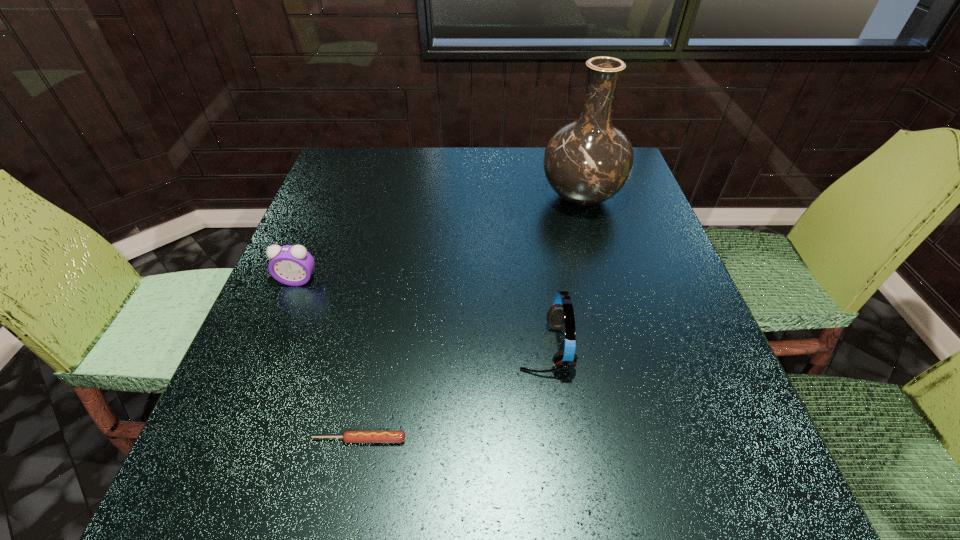
This screenshot has width=960, height=540. In order to click on vase in this screenshot , I will do coord(586,162).

This screenshot has width=960, height=540. Identify the location of the tallest object. click(x=586, y=162).

Where is `the third farthest object`? The image size is (960, 540). the third farthest object is located at coordinates (561, 314).

Image resolution: width=960 pixels, height=540 pixels. I want to click on headset, so click(x=561, y=314).

Identify the location of alarm clock. (292, 265).

In order to click on the third nearest object in this screenshot , I will do `click(292, 265)`.

The height and width of the screenshot is (540, 960). In order to click on the shortest object in this screenshot , I will do pos(349,436).

In order to click on the nearest object in this screenshot , I will do `click(349, 436)`.

Where is `vacant space located on the left of the vase`? The image size is (960, 540). vacant space located on the left of the vase is located at coordinates (431, 197).

I want to click on free space located with the microphone attached to the side of the second tallest object, so click(x=465, y=347).